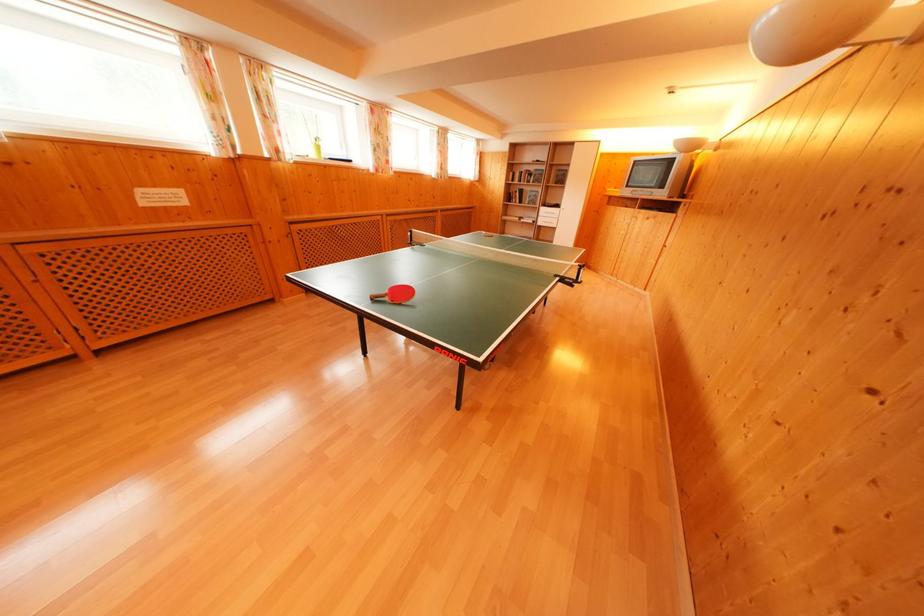
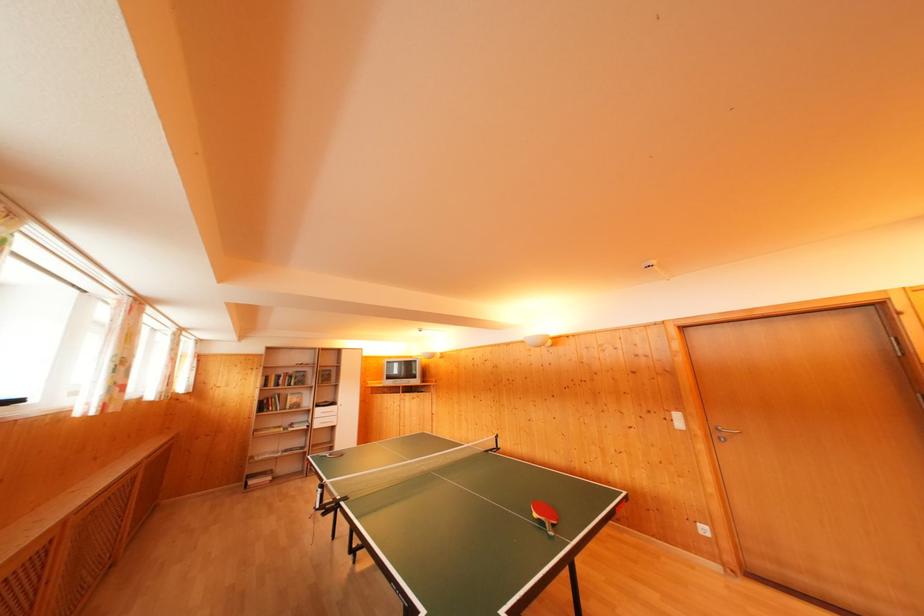
The point at (537, 174) is marked in the first image. Where is the corresponding point in the second image?

(296, 376)